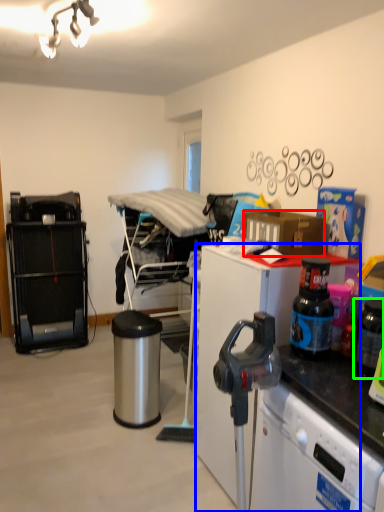
Question: Considering the real-world distances, which object is closest to box (highlighted by a red box)? desk (highlighted by a blue box) or appliance (highlighted by a green box).

Choices:
 (A) desk
 (B) appliance

Answer: (A)